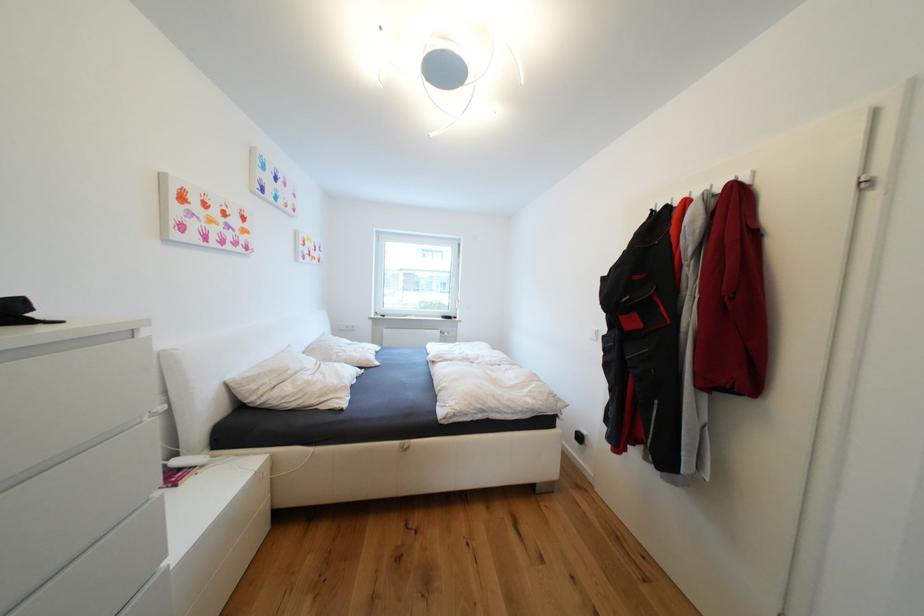
Find the location of a particular element. metal coat hook is located at coordinates (718, 184).